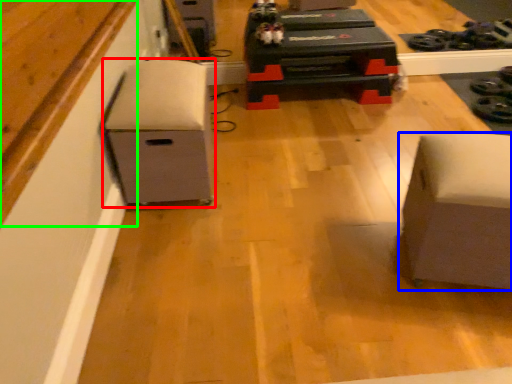
Question: Which is nearer to the furniture (highlighted by a red box)? furniture (highlighted by a blue box) or wood (highlighted by a green box).

Choices:
 (A) furniture
 (B) wood

Answer: (B)